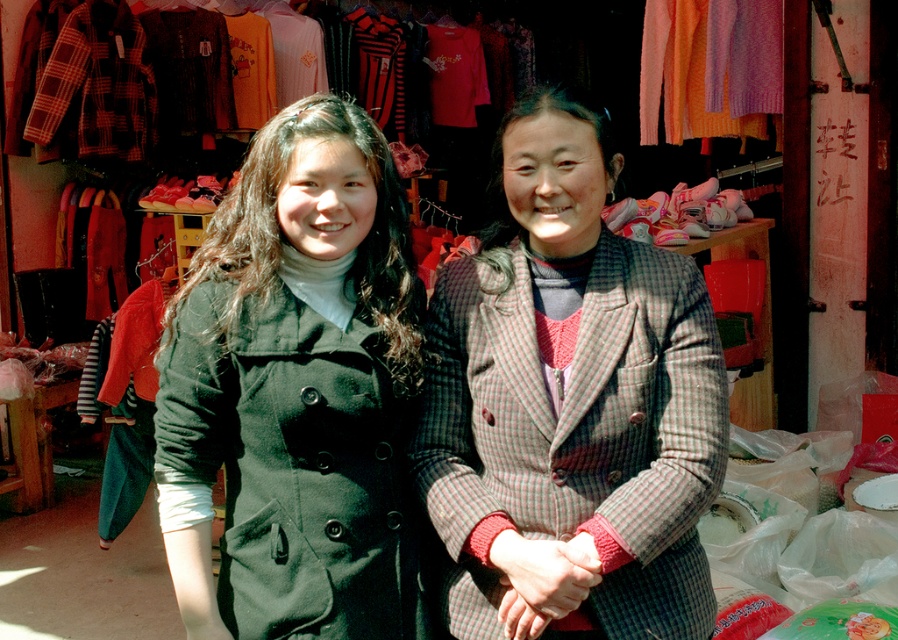
Is matte black coat at left further to camera compared to plaid woolen jacket at center?

That is True.

Does matte black coat at left have a lesser width compared to plaid woolen jacket at center?

Yes.

Is point (376, 212) positioned in front of point (687, 483)?

No.

Find the location of a particular element. The height and width of the screenshot is (640, 898). matte black coat at left is located at coordinates (301, 385).